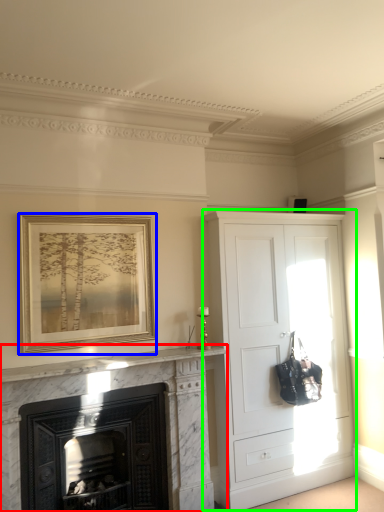
Question: Estimate the real-world distances between objects in this image. Which object is farther from fireplace (highlighted by a red box), picture frame (highlighted by a blue box) or cupboard (highlighted by a green box)?

Choices:
 (A) picture frame
 (B) cupboard

Answer: (B)